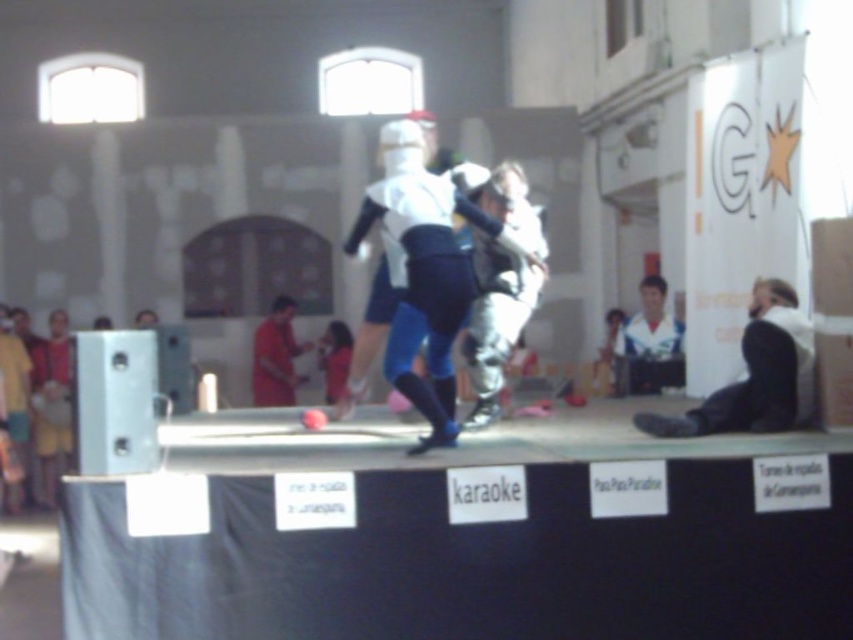
You are a stagehand at the medieval event. You need to place a banner between the white matte helmet at center and the orange matte shirt at center. Which object should the banner be placed above?

The banner should be placed above the white matte helmet at center because it is already positioned above the orange matte shirt at center.

You are an event organizer who needs to ensure safety during the medieval performance. The white matte helmet at center and orange matte shirt at center are part of the performers attire. Which one of these items is larger in size?

The white matte helmet at center is bigger than the orange matte shirt at center.

You are a photographer at the medieval event. You need to capture a photo of both the white matte helmet at center and the orange matte shirt at center. Which object should you position to the left side of your frame to include both in the shot?

The orange matte shirt at center should be positioned to the left side of your frame because the white matte helmet at center is to the right of it, ensuring both are included in the shot.